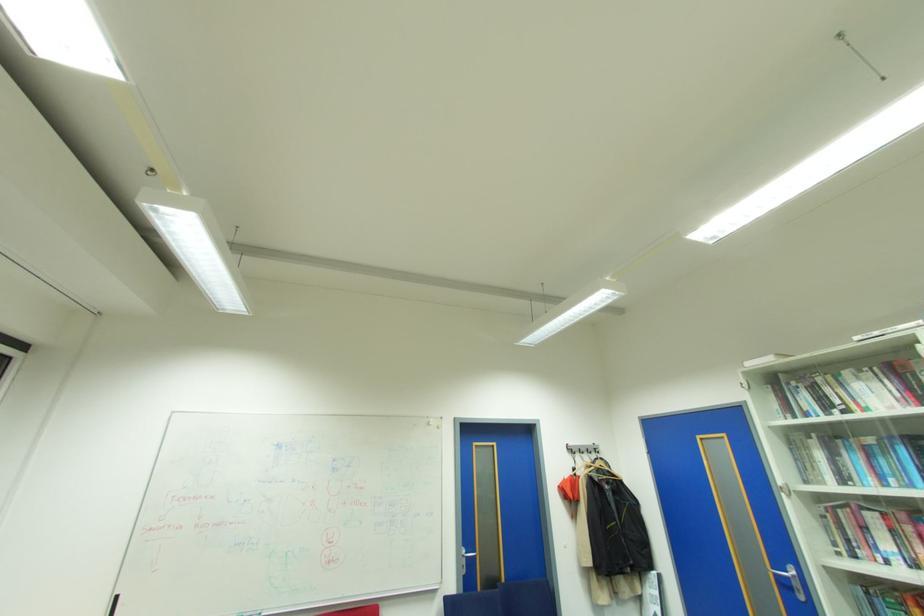
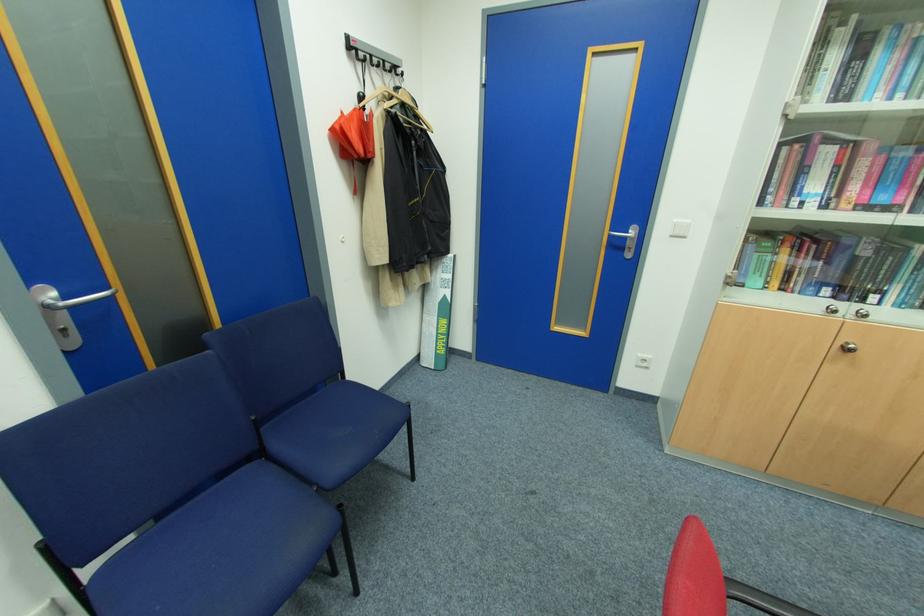
In the second image, find the point that corresponds to pixel 791 572 in the first image.

(630, 233)